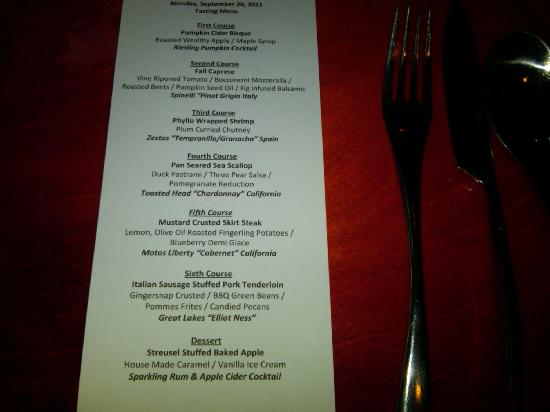
Where is `butter knife handle`? butter knife handle is located at coordinates click(x=499, y=245).